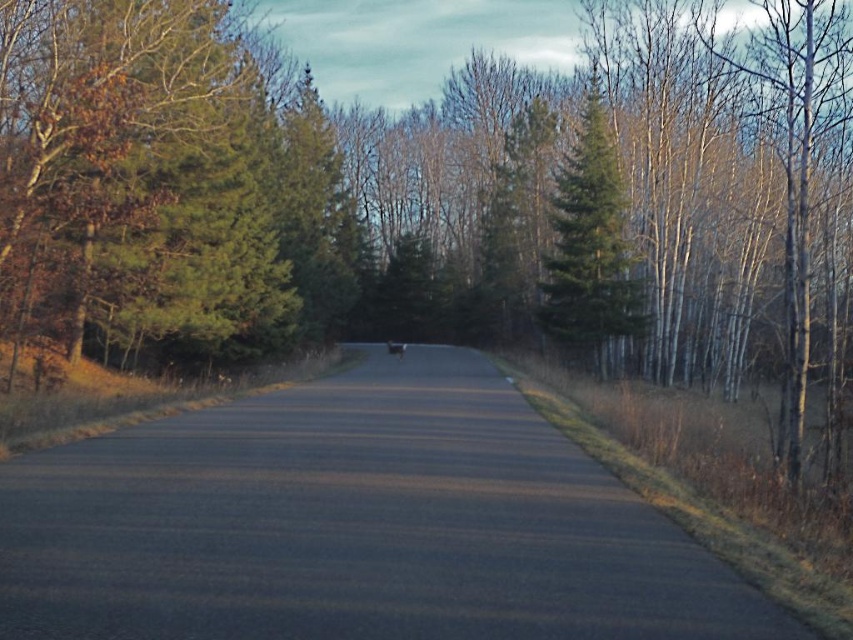
Consider the image. Does asphalt road at center have a larger size compared to green matte tree at center?

No, asphalt road at center is not bigger than green matte tree at center.

Does asphalt road at center appear over green matte tree at center?

Incorrect, asphalt road at center is not positioned above green matte tree at center.

Image resolution: width=853 pixels, height=640 pixels. I want to click on asphalt road at center, so click(x=354, y=524).

Identify the location of asphalt road at center. (354, 524).